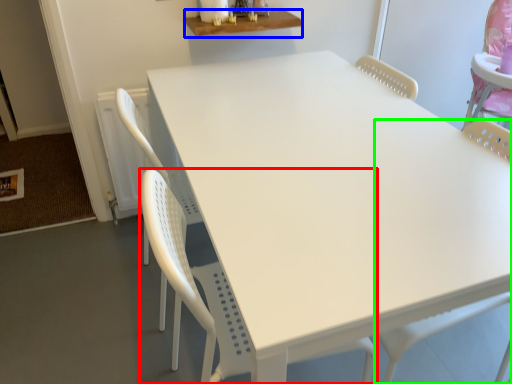
Question: Estimate the real-world distances between objects in this image. Which object is farther from chair (highlighted by a red box), table (highlighted by a blue box) or swivel chair (highlighted by a green box)?

Choices:
 (A) table
 (B) swivel chair

Answer: (A)